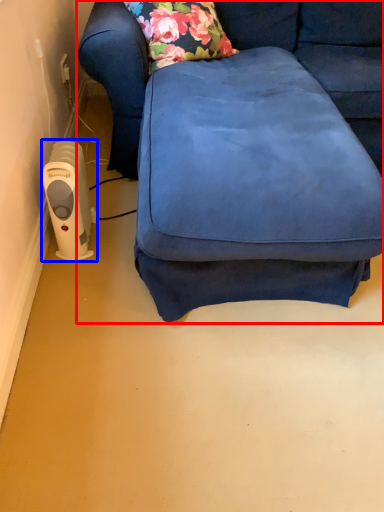
Question: Among these objects, which one is nearest to the camera, studio couch (highlighted by a red box) or appliance (highlighted by a blue box)?

Choices:
 (A) studio couch
 (B) appliance

Answer: (A)